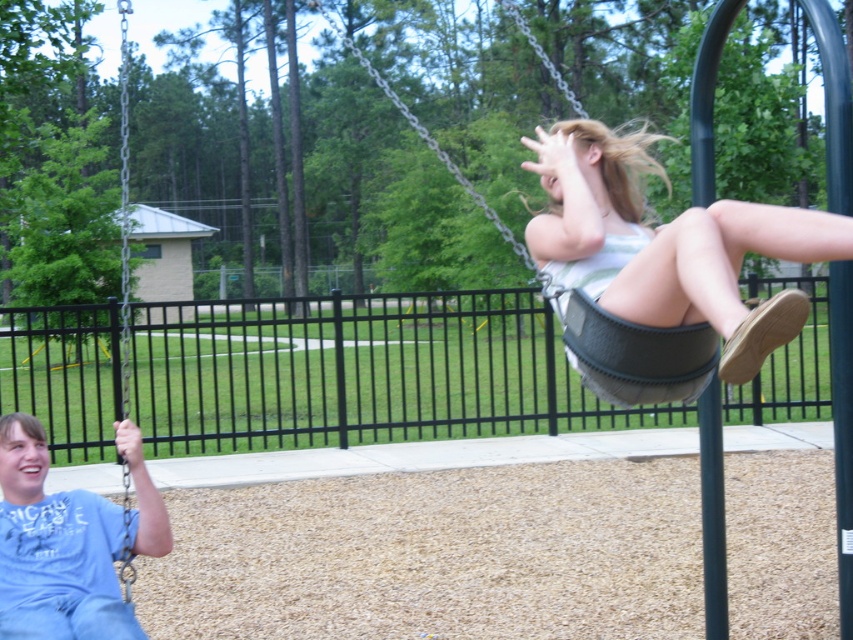
Question: Can you confirm if matte gray swing at center is bigger than gray fabric swing at upper right?

Choices:
 (A) yes
 (B) no

Answer: (B)

Question: Estimate the real-world distances between objects in this image. Which object is closer to the blue cotton shirt at lower left?

Choices:
 (A) gray fabric swing at upper right
 (B) matte gray swing at center

Answer: (B)

Question: Can you confirm if blue cotton shirt at lower left is positioned to the left of gray fabric swing at upper right?

Choices:
 (A) yes
 (B) no

Answer: (A)

Question: Which point appears closest to the camera in this image?

Choices:
 (A) (706, 369)
 (B) (606, 172)
 (C) (25, 586)

Answer: (A)

Question: Is blue cotton shirt at lower left positioned in front of gray fabric swing at upper right?

Choices:
 (A) yes
 (B) no

Answer: (B)

Question: Among these points, which one is farthest from the camera?

Choices:
 (A) (665, 250)
 (B) (694, 342)

Answer: (B)